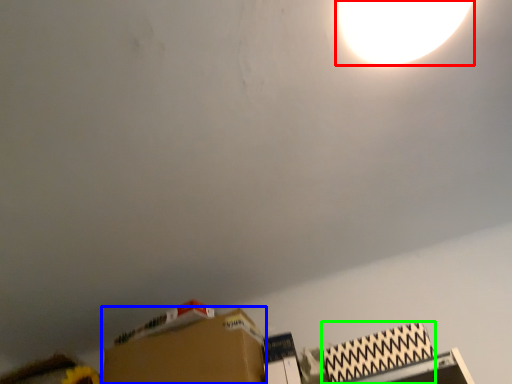
Question: Estimate the real-world distances between objects in this image. Which object is farther from lamp (highlighted by a red box), cardboard box (highlighted by a blue box) or cardboard box (highlighted by a green box)?

Choices:
 (A) cardboard box
 (B) cardboard box

Answer: (A)